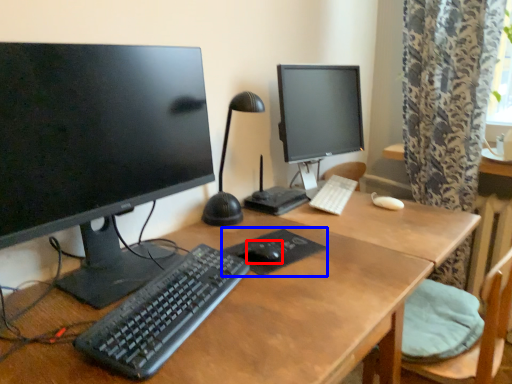
Question: Which object appears farthest to the camera in this image, mouse (highlighted by a red box) or mousepad (highlighted by a blue box)?

Choices:
 (A) mouse
 (B) mousepad

Answer: (A)